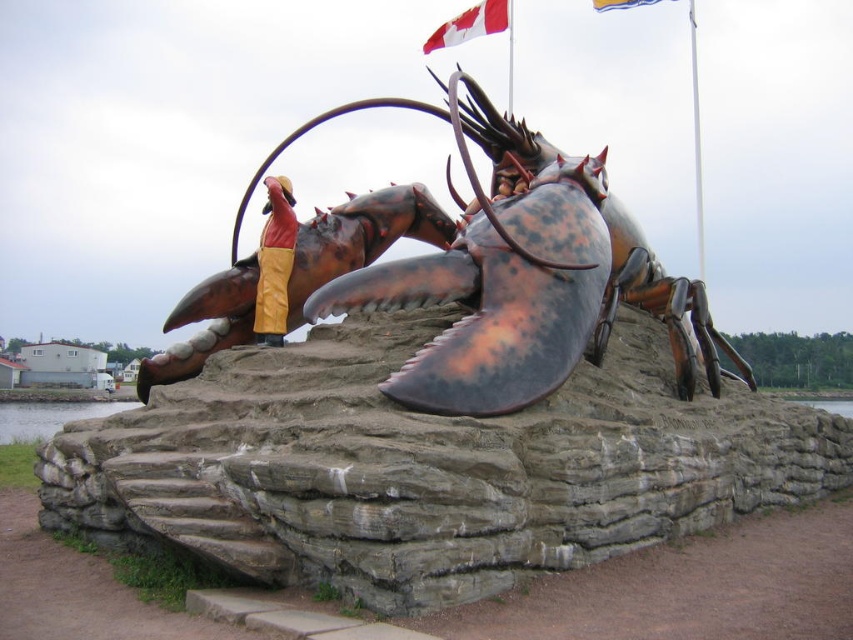
Question: Which object is the closest to the rustic metal lobster at center?

Choices:
 (A) reddish-brown leather pants at center
 (B) white fabric flag at upper center
 (C) rustic copper lobster at center
 (D) red fabric flag at upper center

Answer: (A)

Question: Which of the following is the farthest from the observer?

Choices:
 (A) red fabric flag at upper center
 (B) rustic copper lobster at center
 (C) reddish-brown leather pants at center

Answer: (A)

Question: Does rustic metal lobster at center have a lesser width compared to white fabric flag at upper center?

Choices:
 (A) yes
 (B) no

Answer: (B)

Question: Estimate the real-world distances between objects in this image. Which object is farther from the rustic metal lobster at center?

Choices:
 (A) rustic copper lobster at center
 (B) reddish-brown leather pants at center
 (C) red fabric flag at upper center
 (D) white fabric flag at upper center

Answer: (D)

Question: Does rustic copper lobster at center come in front of red fabric flag at upper center?

Choices:
 (A) no
 (B) yes

Answer: (B)

Question: Is red fabric flag at upper center to the right of white fabric flag at upper center from the viewer's perspective?

Choices:
 (A) no
 (B) yes

Answer: (A)